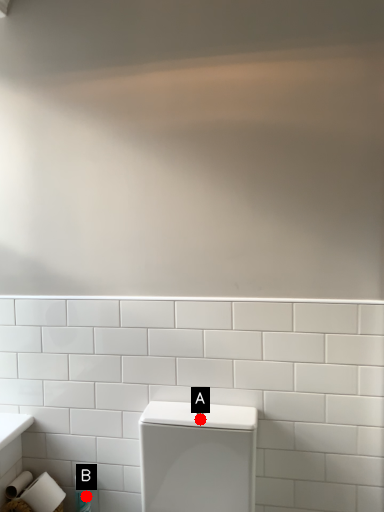
Question: Two points are circled on the image, labeled by A and B beside each circle. Which point is further to the camera?

Choices:
 (A) A is further
 (B) B is further

Answer: (B)